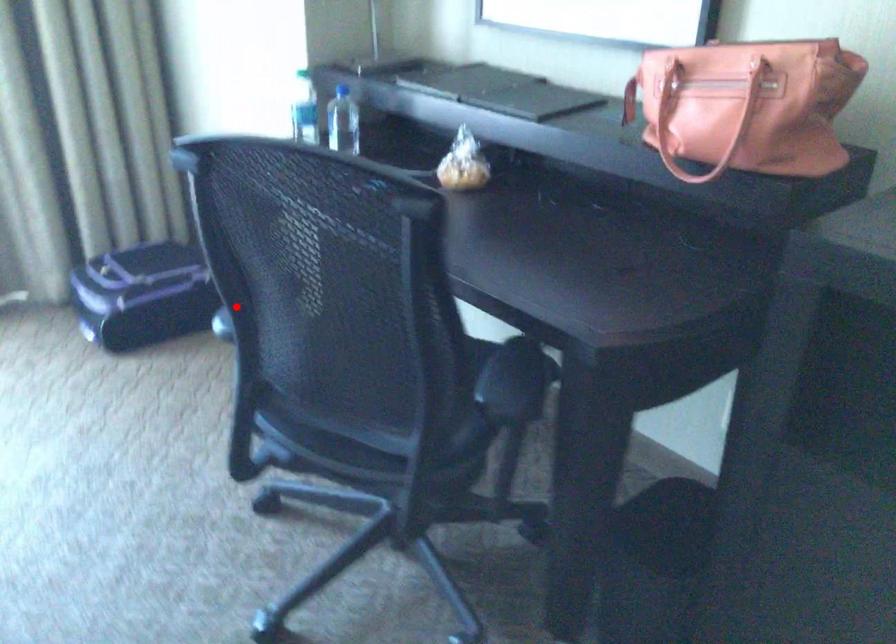
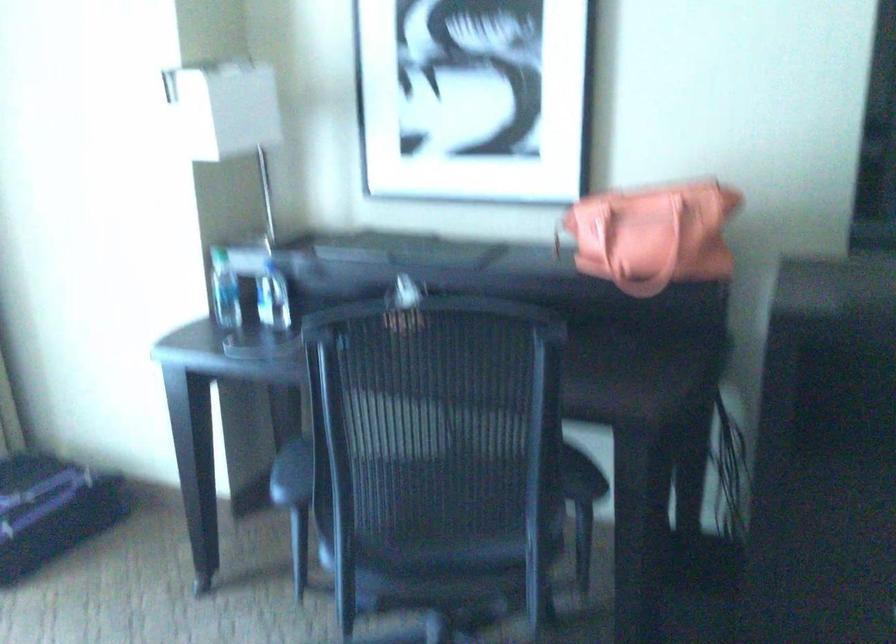
Question: I am providing you with two images of the same scene from different viewpoints. In image1, a red point is highlighted. Considering the same 3D point in image2, which of the following is correct?

Choices:
 (A) It is closer
 (B) It is farther

Answer: (B)